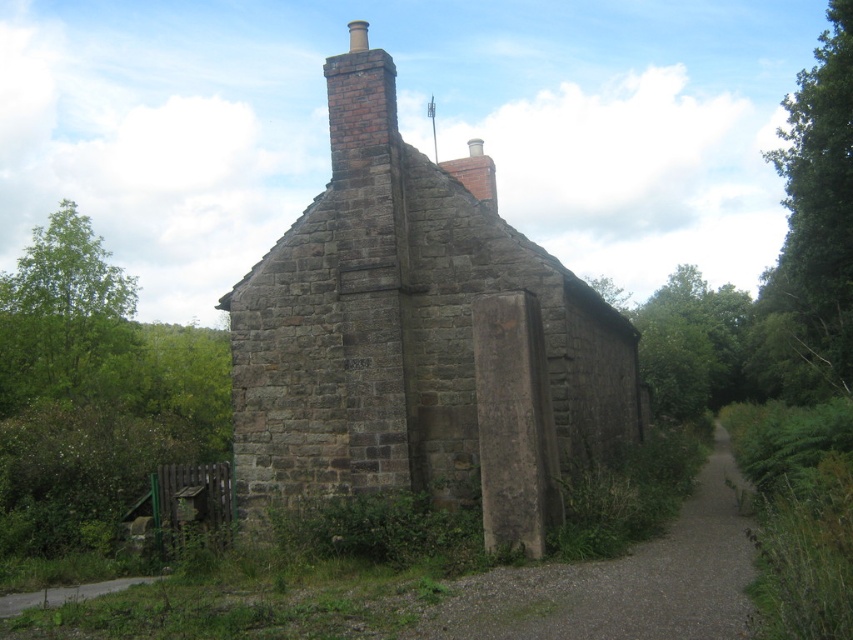
Question: Which object is closer to the camera taking this photo?

Choices:
 (A) brown brick chimney at upper center
 (B) gravel path at center

Answer: (B)

Question: Is green leafy tree at upper right smaller than green leafy tree at left?

Choices:
 (A) yes
 (B) no

Answer: (B)

Question: Which object appears farthest from the camera in this image?

Choices:
 (A) green leafy tree at left
 (B) brown stone cottage at center

Answer: (A)

Question: Is brown stone cottage at center wider than gravel path at center?

Choices:
 (A) yes
 (B) no

Answer: (A)

Question: Is the position of green leafy tree at upper right less distant than that of dirt/gravel path at lower left?

Choices:
 (A) yes
 (B) no

Answer: (B)

Question: Which point is closer to the camera?

Choices:
 (A) gravel path at center
 (B) brown brick chimney at upper center
 (C) brown stone cottage at center

Answer: (A)